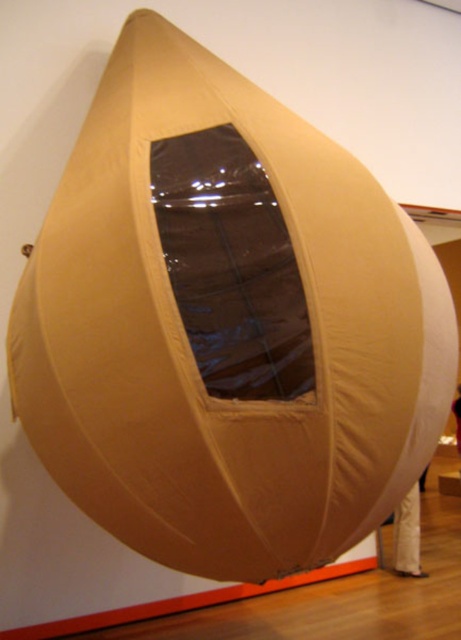
From the picture: You are a delivery person who needs to place a 1.5 meter long package between the beige fabric at lower right and the white fabric at lower right. Can you fit the package between them without moving either fabric?

The beige fabric at lower right and white fabric at lower right are 1.47 meters apart, so the 1.5 meter long package cannot fit between them as the distance is slightly shorter than the package length.